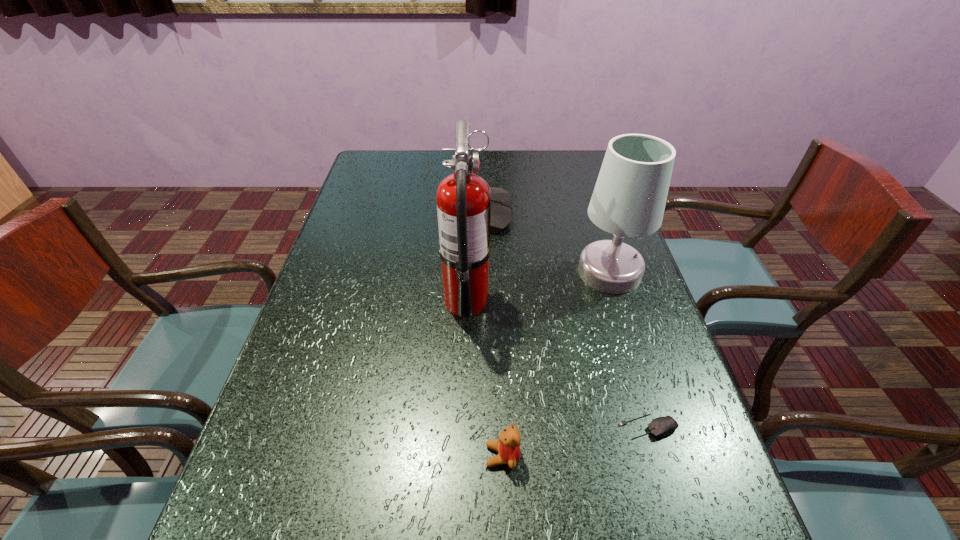
This screenshot has width=960, height=540. What are the coordinates of `object that stands as the second closest to the fire extinguisher` in the screenshot? It's located at (629, 198).

The image size is (960, 540). What are the coordinates of `object that stands as the second closest to the farthest object` in the screenshot? It's located at (629, 198).

You are a GUI agent. You are given a task and a screenshot of the screen. Output one action in this format:
    pyautogui.click(x=<x>, y=<y>)
    Task: Click on the free space that satisfies the following two spatial constraints: 1. on the back side of the mouse; 2. on the nozzle side of the fire extinguisher
    Image resolution: width=960 pixels, height=540 pixels.
    Given the screenshot: What is the action you would take?
    coord(611,301)

Where is `free space in the image that satisfies the following two spatial constraints: 1. on the nozzle side of the shortest object; 2. on the right side of the fire extinguisher`? free space in the image that satisfies the following two spatial constraints: 1. on the nozzle side of the shortest object; 2. on the right side of the fire extinguisher is located at coordinates (463, 427).

Image resolution: width=960 pixels, height=540 pixels. I want to click on free spot that satisfies the following two spatial constraints: 1. on the base of the second tallest object; 2. on the front-facing side of the fourth tallest object, so click(668, 456).

Locate an element on the screen. The image size is (960, 540). vacant space that satisfies the following two spatial constraints: 1. on the back of the router; 2. on the right side of the shortest object is located at coordinates (492, 427).

You are a GUI agent. You are given a task and a screenshot of the screen. Output one action in this format:
    pyautogui.click(x=<x>, y=<y>)
    Task: Click on the vacant space that satisfies the following two spatial constraints: 1. on the base of the fourth shortest object; 2. on the front-facing side of the fourth tallest object
    
    Given the screenshot: What is the action you would take?
    [668, 456]

The image size is (960, 540). Identify the location of free space that satisfies the following two spatial constraints: 1. on the nozzle side of the tallest object; 2. on the left side of the shortest object. 463,427.

Identify the location of vacant area in the image that satisfies the following two spatial constraints: 1. on the back of the router; 2. on the right side of the shortest object. (492, 427).

You are a GUI agent. You are given a task and a screenshot of the screen. Output one action in this format:
    pyautogui.click(x=<x>, y=<y>)
    Task: Click on the blank space that satisfies the following two spatial constraints: 1. on the front side of the shortest object; 2. on the front-facing side of the second shortest object
    This screenshot has width=960, height=540.
    Given the screenshot: What is the action you would take?
    pyautogui.click(x=657, y=456)